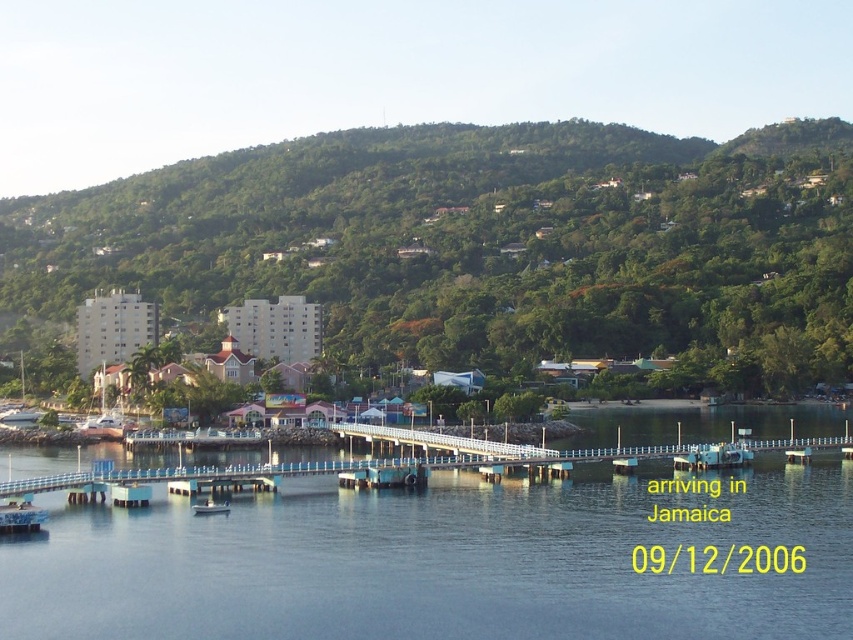
Question: Among these objects, which one is nearest to the camera?

Choices:
 (A) white plastic boat at lower center
 (B) green leafy hillside at upper center

Answer: (A)

Question: Is green leafy hillside at upper center below white plastic boat at lower center?

Choices:
 (A) yes
 (B) no

Answer: (B)

Question: Is green leafy hillside at upper center smaller than white plastic boat at lower center?

Choices:
 (A) no
 (B) yes

Answer: (A)

Question: Considering the real-world distances, which object is closest to the blue concrete bridge at center?

Choices:
 (A) green leafy hillside at upper center
 (B) white plastic boat at lower center

Answer: (B)

Question: Does green leafy hillside at upper center have a larger size compared to white plastic boat at lower center?

Choices:
 (A) yes
 (B) no

Answer: (A)

Question: Which point is farther to the camera?

Choices:
 (A) (201, 509)
 (B) (801, 216)
 (C) (378, 532)

Answer: (B)